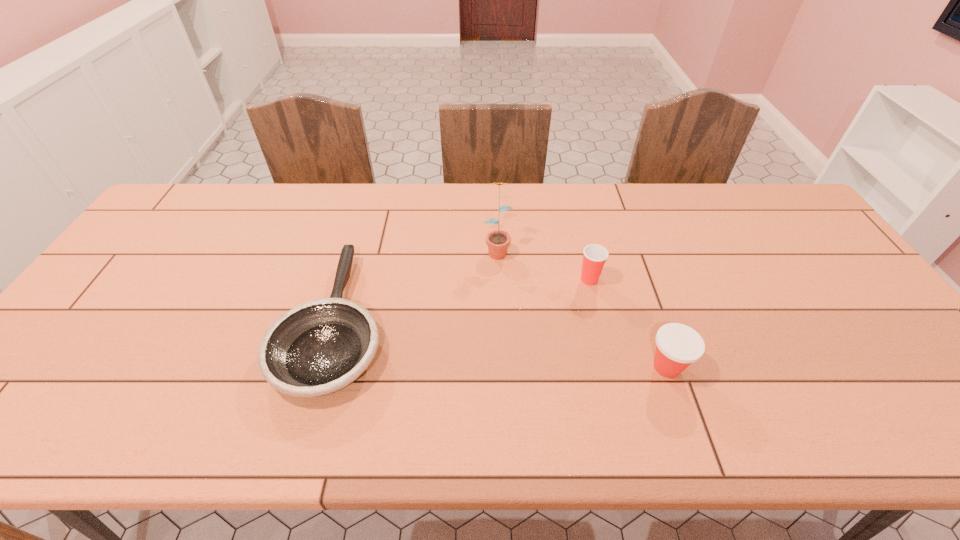
The height and width of the screenshot is (540, 960). Identify the location of blank area located on the right of the right Dixie cup. (794, 367).

Where is `blank area located on the handle side of the frying pan`? The image size is (960, 540). blank area located on the handle side of the frying pan is located at coordinates (370, 205).

Image resolution: width=960 pixels, height=540 pixels. What are the coordinates of `vacant space situated 0.200m on the handle side of the frying pan` in the screenshot? It's located at (366, 216).

The height and width of the screenshot is (540, 960). I want to click on free spot located on the handle side of the frying pan, so click(x=370, y=205).

The height and width of the screenshot is (540, 960). Identify the location of object located in the near edge section of the desktop. (320, 347).

You are a GUI agent. You are given a task and a screenshot of the screen. Output one action in this format:
    pyautogui.click(x=<x>, y=<y>)
    Task: Click on the vacant space at the far edge of the desktop
    
    Given the screenshot: What is the action you would take?
    pyautogui.click(x=299, y=195)

In the image, there is a desktop. In order to click on free region at the right edge in this screenshot , I will do `click(885, 325)`.

Find the location of a particular element. free space at the far left corner is located at coordinates (208, 216).

At what (x,y) coordinates should I click in order to perform the action: click on free space between the right Dixie cup and the leftmost object. Please return your answer as a coordinate pair (x, y). The image size is (960, 540). Looking at the image, I should click on (501, 345).

In order to click on free spot between the third object from left to right and the frying pan in this screenshot , I will do `click(463, 301)`.